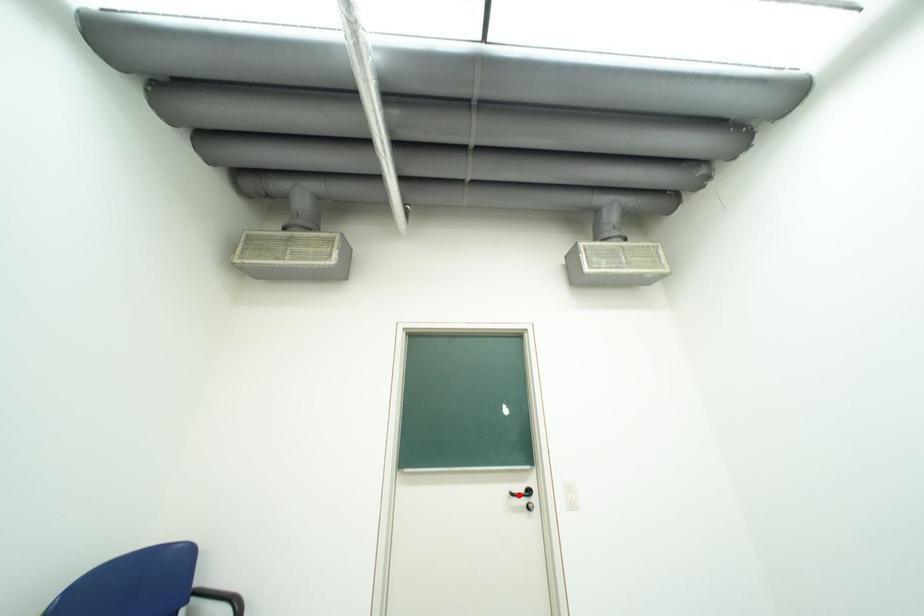
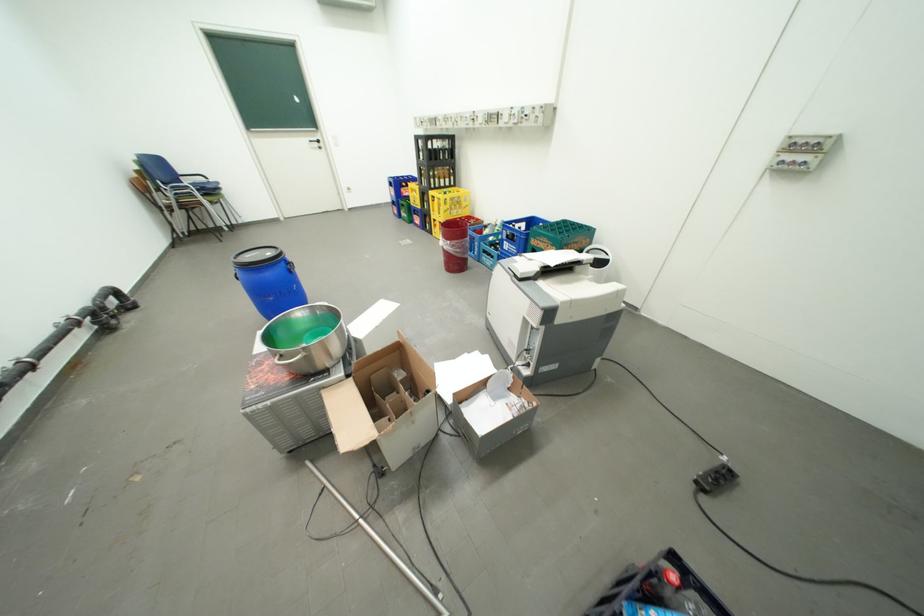
Where in the second image is the point corresponding to the highlighted location from the first image?

(320, 143)